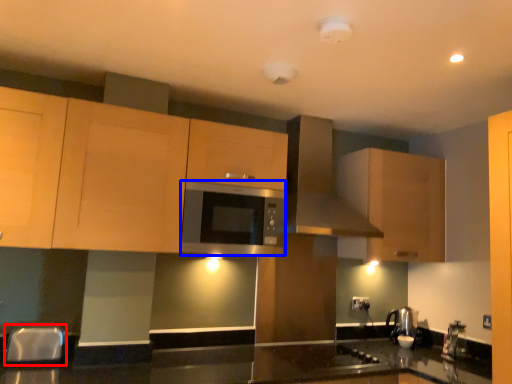
Question: Which of the following is the closest to the observer, silver (highlighted by a red box) or microwave (highlighted by a blue box)?

Choices:
 (A) silver
 (B) microwave

Answer: (A)